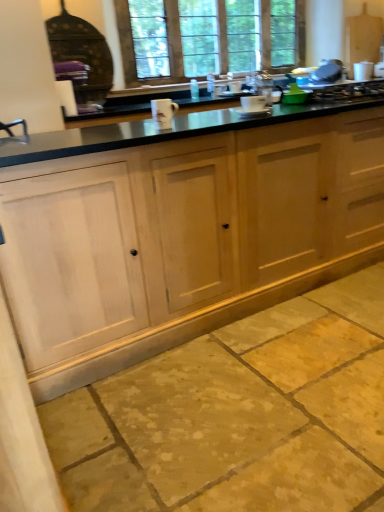
Question: From the image's perspective, is white ceramic mug at center, acting as the second appliance starting from the back, positioned above or below natural stone floor at lower center?

Choices:
 (A) above
 (B) below

Answer: (A)

Question: In terms of height, does white ceramic mug at center, marked as the second appliance in a right-to-left arrangement, look taller or shorter compared to natural stone floor at lower center?

Choices:
 (A) tall
 (B) short

Answer: (A)

Question: Based on their relative distances, which object is farther from the white ceramic mug at center, placed as the 1th appliance when sorted from back to front?

Choices:
 (A) natural stone floor at lower center
 (B) clear glass window at upper center
 (C) natural wood cabinets at center
 (D) white ceramic mug at center, which is counted as the first appliance, starting from the left
 (E) metallic silver gas stove at upper right

Answer: (B)

Question: Considering the real-world distances, which object is farthest from the metallic silver gas stove at upper right?

Choices:
 (A) clear glass window at upper center
 (B) white ceramic mug at center, placed as the 1th appliance when sorted from back to front
 (C) white ceramic mug at center, which is the 1th appliance in bottom-to-top order
 (D) natural wood cabinets at center
 (E) natural stone floor at lower center

Answer: (A)